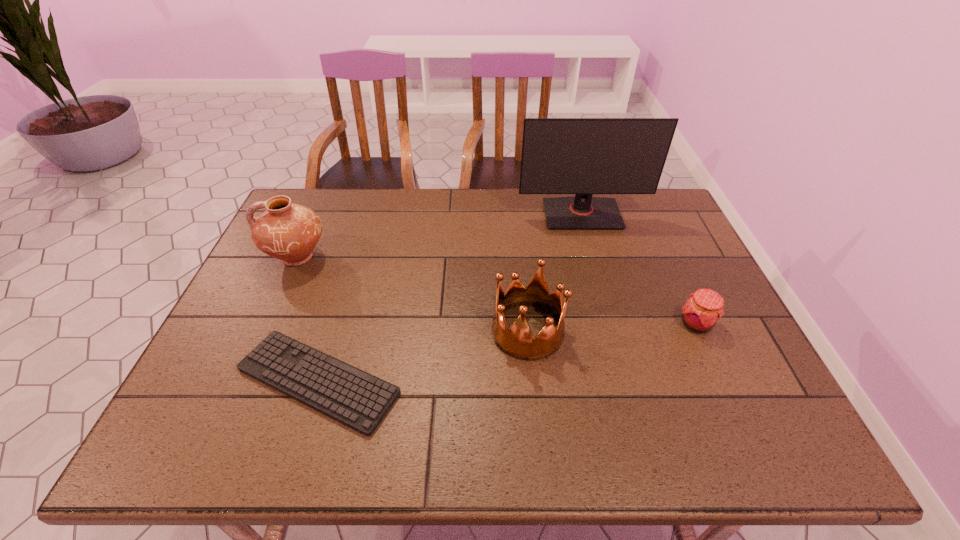
This screenshot has width=960, height=540. In order to click on vacant space at the left edge in this screenshot , I will do `click(234, 361)`.

The width and height of the screenshot is (960, 540). I want to click on vacant space at the right edge of the desktop, so click(661, 276).

Identify the location of vacant space in between the computer keyboard and the third shortest object. (422, 356).

Find the location of a particular element. This screenshot has height=540, width=960. free space between the fourth nearest object and the computer keyboard is located at coordinates (308, 319).

At what (x,y) coordinates should I click in order to perform the action: click on vacant area that lies between the crown and the shortest object. Please return your answer as a coordinate pair (x, y). The image size is (960, 540). Looking at the image, I should click on (422, 356).

The width and height of the screenshot is (960, 540). In order to click on vacant region between the pottery and the jam in this screenshot , I will do `click(497, 291)`.

The image size is (960, 540). I want to click on vacant space in between the computer keyboard and the farthest object, so click(450, 298).

This screenshot has width=960, height=540. I want to click on unoccupied area between the shortest object and the second farthest object, so click(308, 319).

Where is `empty space that is in between the farthest object and the pottery`? The height and width of the screenshot is (540, 960). empty space that is in between the farthest object and the pottery is located at coordinates 440,235.

In order to click on free space that is in between the monitor and the second farthest object in this screenshot , I will do `click(440, 235)`.